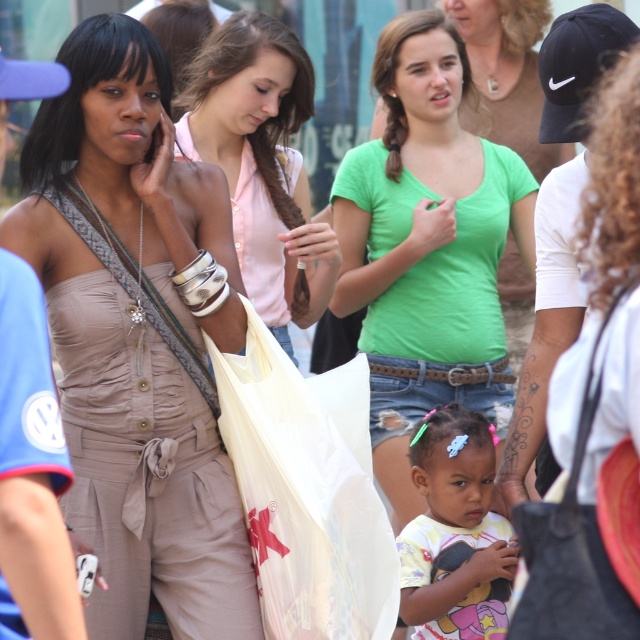
Who is positioned more to the left, green cotton shirt at center or pink satin blouse at center?

Result: pink satin blouse at center

Between green cotton shirt at center and pink satin blouse at center, which one is positioned lower?

green cotton shirt at center is below.

Which is in front, point (392, 339) or point (320, 256)?

Point (320, 256) is more forward.

What are the coordinates of `green cotton shirt at center` in the screenshot? It's located at (426, 246).

Can you confirm if white plastic bag at center is positioned below pastel yellow t-shirt at center?

No, white plastic bag at center is not below pastel yellow t-shirt at center.

Is point (365, 552) farther from camera compared to point (472, 561)?

No, it is not.

Is point (348, 394) positioned in front of point (422, 556)?

Yes, point (348, 394) is closer to viewer.

At what (x,y) coordinates should I click in order to perform the action: click on white plastic bag at center. Please return your answer as a coordinate pair (x, y). Looking at the image, I should click on (307, 492).

Who is taller, matte beige jumpsuit at center or white plastic bag at center?

matte beige jumpsuit at center

In the scene shown: Who is more forward, (196, 353) or (300, 426)?

Positioned in front is point (300, 426).

Which is behind, point (84, 118) or point (305, 637)?

The point (84, 118) is behind.

Locate an element on the screen. The height and width of the screenshot is (640, 640). matte beige jumpsuit at center is located at coordinates (138, 336).